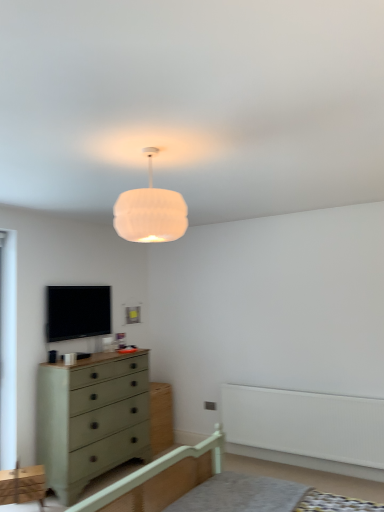
The image size is (384, 512). I want to click on green painted wood chest of drawers at lower left, so click(x=91, y=419).

In order to click on white fabric lampshade at upper center in this screenshot , I will do `click(150, 211)`.

What is the approximate width of white fabric lampshade at upper center?

16.15 inches.

What do you see at coordinates (23, 485) in the screenshot? I see `green matte cabinet at lower left` at bounding box center [23, 485].

Locate an element on the screen. This screenshot has height=512, width=384. green painted wood chest of drawers at lower left is located at coordinates (91, 419).

From the image's perspective, is green painted wood chest of drawers at lower left above white fabric lampshade at upper center?

No, from the image's perspective, green painted wood chest of drawers at lower left is not over white fabric lampshade at upper center.

Which object is closer to the camera, green painted wood chest of drawers at lower left or white fabric lampshade at upper center?

white fabric lampshade at upper center is in front.

Looking at the image, does green painted wood chest of drawers at lower left seem bigger or smaller compared to white fabric lampshade at upper center?

Considering their sizes, green painted wood chest of drawers at lower left takes up more space than white fabric lampshade at upper center.

From the picture: How distant is green painted wood chest of drawers at lower left from white fabric lampshade at upper center?

7.45 feet.

Are white painted wood bed frame at center and green painted wood chest of drawers at lower left located far from each other?

white painted wood bed frame at center is positioned a significant distance from green painted wood chest of drawers at lower left.

Where is `the chest of drawers beneath the white painted wood bed frame at center (from a real-world perspective)`? The width and height of the screenshot is (384, 512). the chest of drawers beneath the white painted wood bed frame at center (from a real-world perspective) is located at coordinates (91, 419).

Which object is positioned more to the right, white painted wood bed frame at center or green painted wood chest of drawers at lower left?

white painted wood bed frame at center is more to the right.

Is green painted wood chest of drawers at lower left completely or partially outside of white plastic balustrade at lower right?

Indeed, green painted wood chest of drawers at lower left is completely outside white plastic balustrade at lower right.

Considering the relative positions of green painted wood chest of drawers at lower left and white plastic balustrade at lower right in the image provided, is green painted wood chest of drawers at lower left to the right of white plastic balustrade at lower right from the viewer's perspective?

Incorrect, green painted wood chest of drawers at lower left is not on the right side of white plastic balustrade at lower right.

Between point (70, 382) and point (355, 448), which one is positioned in front?

The point (70, 382) is closer.

Between green painted wood chest of drawers at lower left and white plastic balustrade at lower right, which one has more height?

Standing taller between the two is green painted wood chest of drawers at lower left.

Is white painted wood bed frame at center facing away from white plastic balustrade at lower right?

No, white painted wood bed frame at center is not facing the opposite direction of white plastic balustrade at lower right.

Between white painted wood bed frame at center and white plastic balustrade at lower right, which one has smaller size?

Smaller between the two is white plastic balustrade at lower right.

Is white painted wood bed frame at center further to camera compared to white plastic balustrade at lower right?

Result: No, the depth of white painted wood bed frame at center is less than that of white plastic balustrade at lower right.

Is white painted wood bed frame at center positioned far away from white plastic balustrade at lower right?

Result: That's right, there is a large distance between white painted wood bed frame at center and white plastic balustrade at lower right.

Consider the image. From a real-world perspective, relative to green matte cabinet at lower left, is white painted wood bed frame at center vertically above or below?

From a real-world perspective, white painted wood bed frame at center is physically above green matte cabinet at lower left.

From the image's perspective, relative to green matte cabinet at lower left, is white painted wood bed frame at center above or below?

white painted wood bed frame at center is above green matte cabinet at lower left.

Which of these two, white painted wood bed frame at center or green matte cabinet at lower left, is smaller?

green matte cabinet at lower left is smaller.

Which is more to the left, white plastic balustrade at lower right or black glossy tv at upper left?

Positioned to the left is black glossy tv at upper left.

Considering the points (298, 413) and (56, 333), which point is in front, point (298, 413) or point (56, 333)?

The point (298, 413) is more forward.

From the image's perspective, is white plastic balustrade at lower right located above or below black glossy tv at upper left?

From the image's perspective, white plastic balustrade at lower right appears below black glossy tv at upper left.

Are white plastic balustrade at lower right and black glossy tv at upper left far apart?

That's right, there is a large distance between white plastic balustrade at lower right and black glossy tv at upper left.

Considering the positions of points (6, 500) and (124, 373), is point (6, 500) farther from camera compared to point (124, 373)?

No, it is in front of (124, 373).

Who is bigger, green matte cabinet at lower left or green painted wood chest of drawers at lower left?

With larger size is green painted wood chest of drawers at lower left.

What's the angular difference between green matte cabinet at lower left and green painted wood chest of drawers at lower left's facing directions?

37.1 degrees.

Is the position of green matte cabinet at lower left more distant than that of green painted wood chest of drawers at lower left?

That is False.

Identify the location of chest of drawers that appears on the left of white fabric lampshade at upper center. The image size is (384, 512). (91, 419).

The width and height of the screenshot is (384, 512). In order to click on bed frame on the right of the green painted wood chest of drawers at lower left in this screenshot , I will do `click(159, 479)`.

From the image, which object appears to be nearer to black glossy tv at upper left, green painted wood chest of drawers at lower left or white plastic balustrade at lower right?

green painted wood chest of drawers at lower left is closer to black glossy tv at upper left.

Based on their spatial positions, is green painted wood chest of drawers at lower left or green matte cabinet at lower left closer to white plastic balustrade at lower right?

green painted wood chest of drawers at lower left lies closer to white plastic balustrade at lower right than the other object.

Which object lies nearer to the anchor point black glossy tv at upper left, white painted wood bed frame at center or white plastic balustrade at lower right?

white painted wood bed frame at center lies closer to black glossy tv at upper left than the other object.

Considering their positions, is white painted wood bed frame at center positioned further to green painted wood chest of drawers at lower left than green matte cabinet at lower left?

white painted wood bed frame at center.

When comparing their distances from white fabric lampshade at upper center, does green painted wood chest of drawers at lower left or green matte cabinet at lower left seem closer?

green painted wood chest of drawers at lower left.

From the image, which object appears to be nearer to green painted wood chest of drawers at lower left, white painted wood bed frame at center or white plastic balustrade at lower right?

Among the two, white painted wood bed frame at center is located nearer to green painted wood chest of drawers at lower left.

Which object lies further to the anchor point white plastic balustrade at lower right, green matte cabinet at lower left or white painted wood bed frame at center?

The object further to white plastic balustrade at lower right is green matte cabinet at lower left.

Which object lies nearer to the anchor point white plastic balustrade at lower right, green painted wood chest of drawers at lower left or black glossy tv at upper left?

green painted wood chest of drawers at lower left is positioned closer to the anchor white plastic balustrade at lower right.

Where is `chest of drawers between white painted wood bed frame at center and black glossy tv at upper left along the z-axis`? This screenshot has width=384, height=512. chest of drawers between white painted wood bed frame at center and black glossy tv at upper left along the z-axis is located at coordinates (91, 419).

Identify the location of the chest of drawers between white fabric lampshade at upper center and green matte cabinet at lower left vertically. (91, 419).

Locate an element on the screen. The image size is (384, 512). cabinetry located between white painted wood bed frame at center and green painted wood chest of drawers at lower left in the depth direction is located at coordinates (23, 485).

Locate an element on the screen. cabinetry between white painted wood bed frame at center and white plastic balustrade at lower right along the z-axis is located at coordinates pos(23,485).